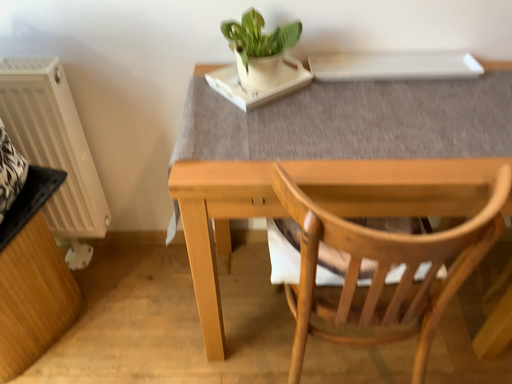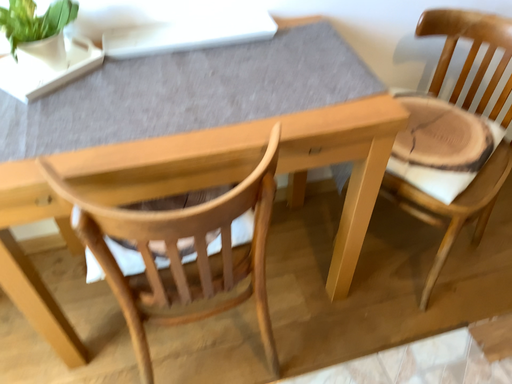
Question: Which way did the camera rotate in the video?

Choices:
 (A) rotated right
 (B) rotated left

Answer: (A)